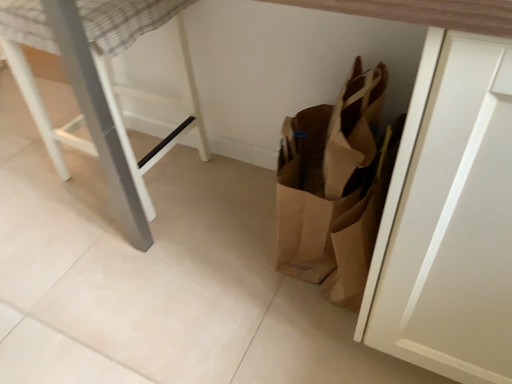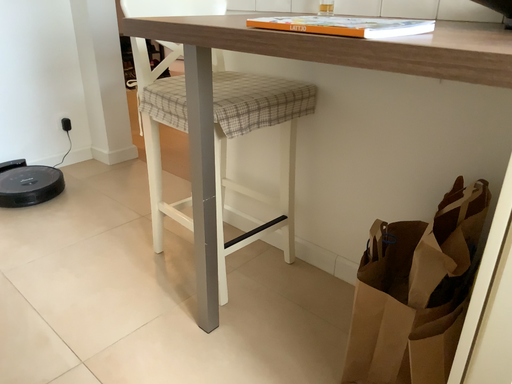
Question: Which way did the camera rotate in the video?

Choices:
 (A) rotated downward
 (B) rotated upward

Answer: (B)